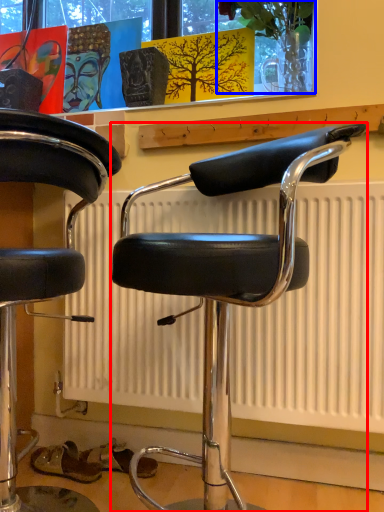
Question: Among these objects, which one is farthest to the camera, chair (highlighted by a red box) or plant (highlighted by a blue box)?

Choices:
 (A) chair
 (B) plant

Answer: (B)